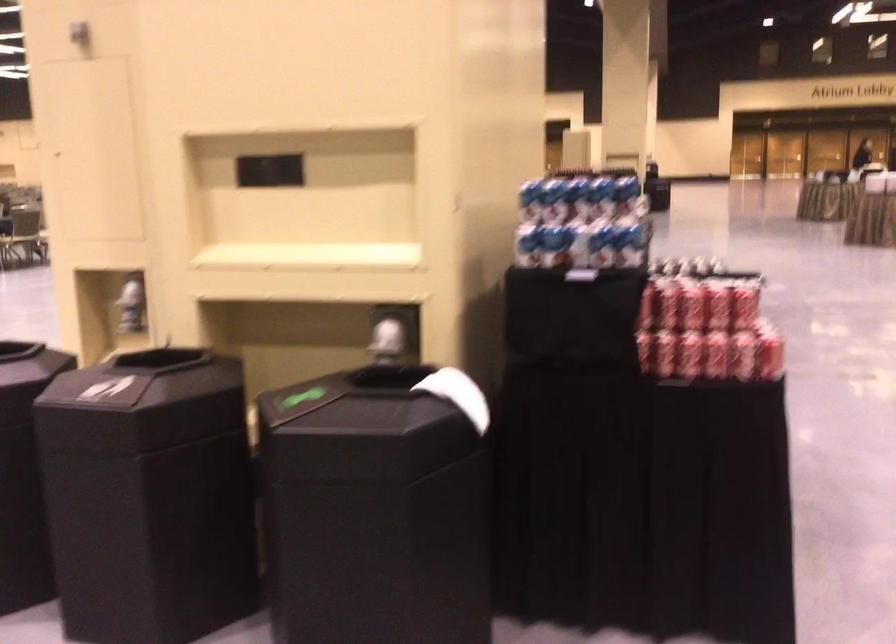
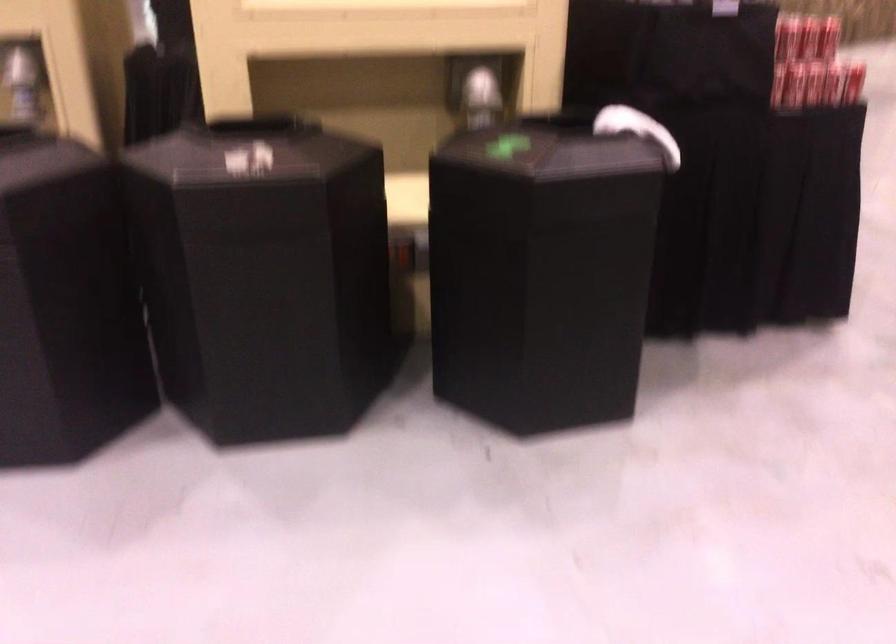
The point at (149, 383) is marked in the first image. Where is the corresponding point in the second image?

(271, 154)